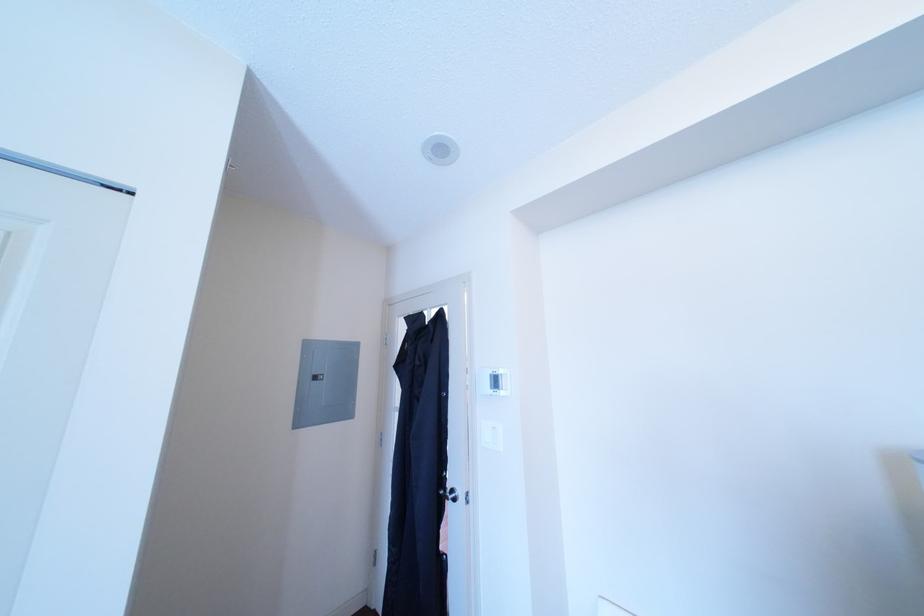
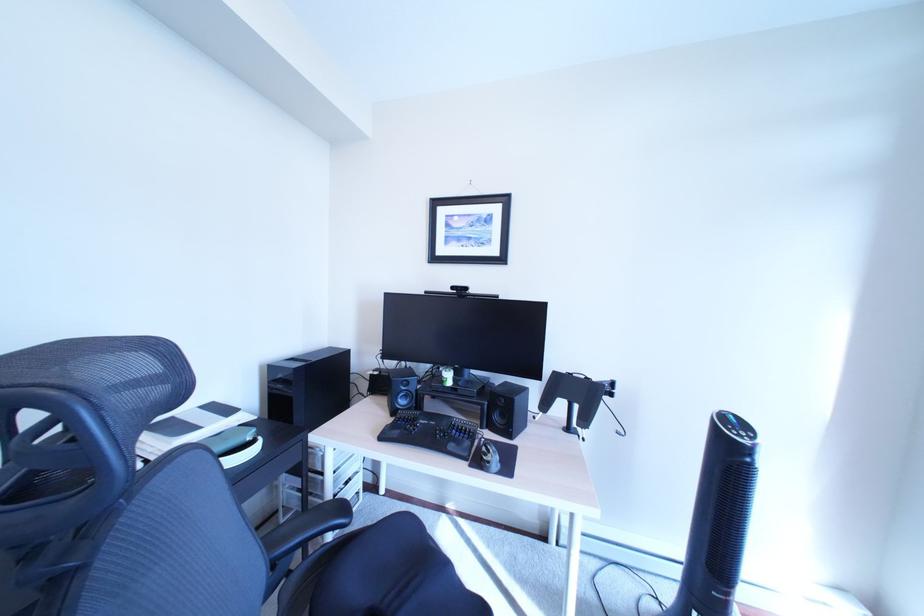
Question: The camera is either moving clockwise (left) or counter-clockwise (right) around the object. The first image is from the beginning of the video and the second image is from the end. Is the camera moving left or right when shooting the video?

Choices:
 (A) Left
 (B) Right

Answer: (A)